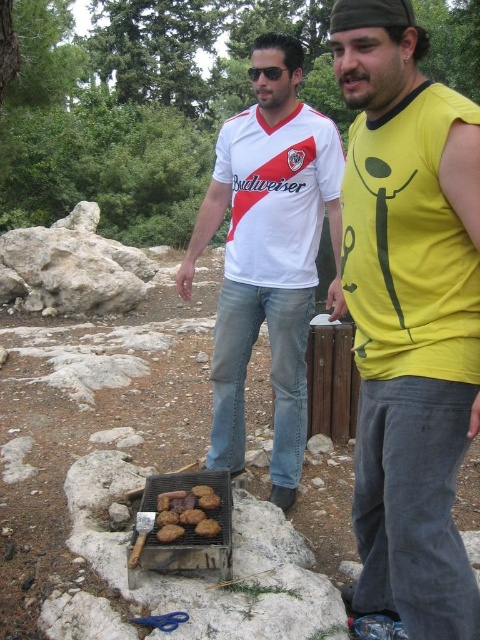
Does charcoal grill at center appear on the left side of brown wooden fence at center?

Yes, charcoal grill at center is to the left of brown wooden fence at center.

In the scene shown: Does charcoal grill at center have a larger size compared to brown wooden fence at center?

Correct, charcoal grill at center is larger in size than brown wooden fence at center.

Is point (172, 545) positioned behind point (337, 344)?

No, (172, 545) is closer to viewer.

Locate an element on the screen. charcoal grill at center is located at coordinates (183, 524).

Can you confirm if white jersey at center is positioned to the left of charcoal grill at center?

Incorrect, white jersey at center is not on the left side of charcoal grill at center.

Can you confirm if white jersey at center is shorter than charcoal grill at center?

Incorrect, white jersey at center's height does not fall short of charcoal grill at center's.

Is point (310, 214) in front of point (228, 513)?

No, it is not.

Locate an element on the screen. white jersey at center is located at coordinates (268, 253).

This screenshot has height=640, width=480. What do you see at coordinates (409, 316) in the screenshot?
I see `yellow matte shirt at center` at bounding box center [409, 316].

Which is behind, point (431, 150) or point (338, 433)?

The point (338, 433) is behind.

Who is more forward, (x=418, y=566) or (x=324, y=428)?

Point (x=418, y=566)

The height and width of the screenshot is (640, 480). I want to click on yellow matte shirt at center, so click(x=409, y=316).